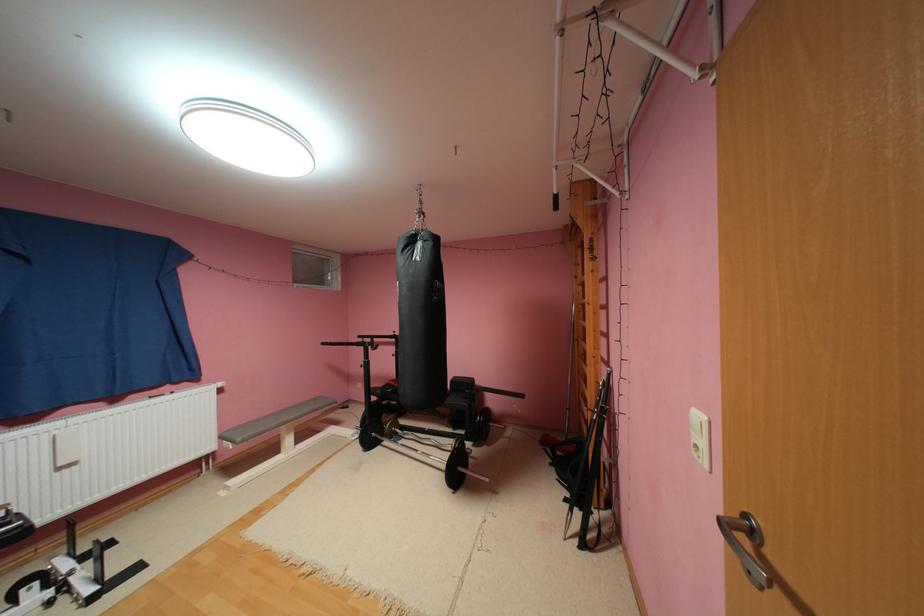
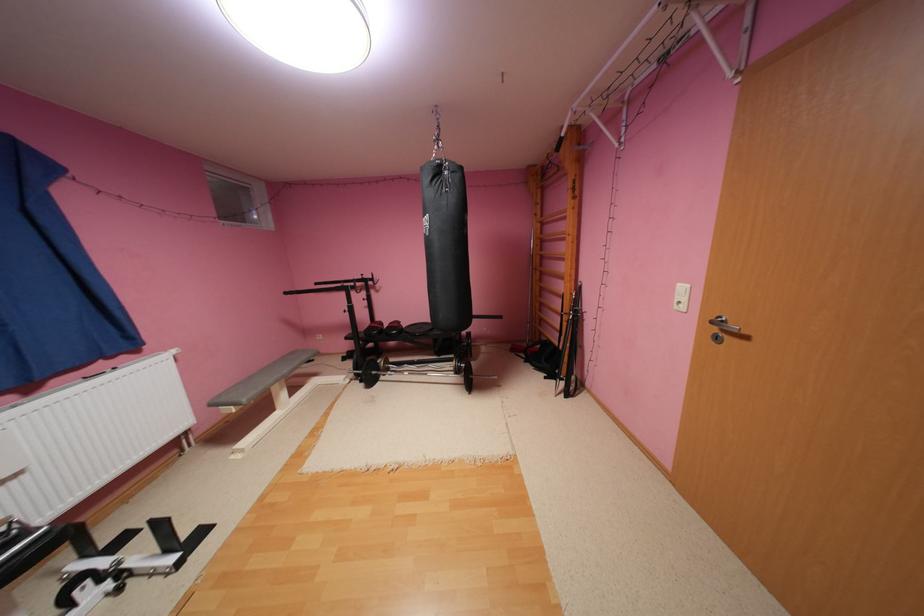
Find the pixel in the second image that matches (402,435) in the first image.

(396, 371)